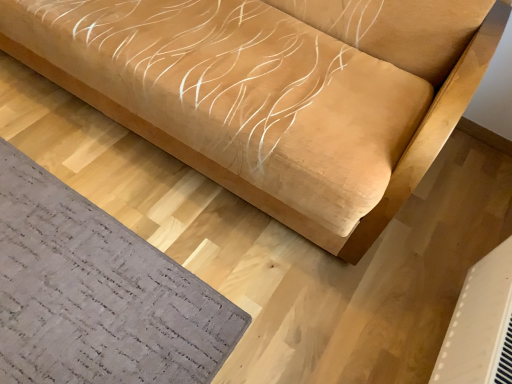
Question: In terms of height, does gray textured mat at lower left look taller or shorter compared to suede-like beige sofa at upper center?

Choices:
 (A) short
 (B) tall

Answer: (A)

Question: Considering the relative positions of gray textured mat at lower left and suede-like beige sofa at upper center in the image provided, is gray textured mat at lower left to the left or to the right of suede-like beige sofa at upper center?

Choices:
 (A) left
 (B) right

Answer: (A)

Question: Which of these objects is positioned closest to the white plastic air conditioning unit at lower right?

Choices:
 (A) suede-like beige sofa at upper center
 (B) gray textured mat at lower left

Answer: (A)

Question: Which is nearer to the white plastic air conditioning unit at lower right?

Choices:
 (A) gray textured mat at lower left
 (B) suede-like beige sofa at upper center

Answer: (B)